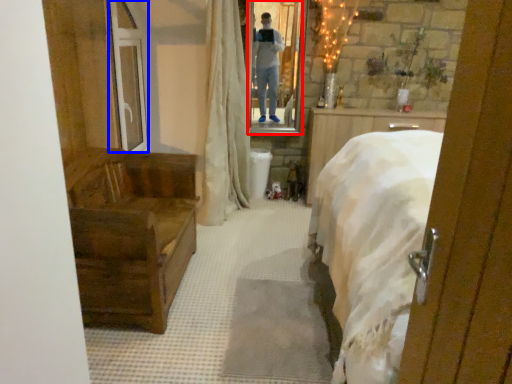
Question: Among these objects, which one is nearest to the camera, mirror (highlighted by a red box) or glass door (highlighted by a blue box)?

Choices:
 (A) mirror
 (B) glass door

Answer: (B)